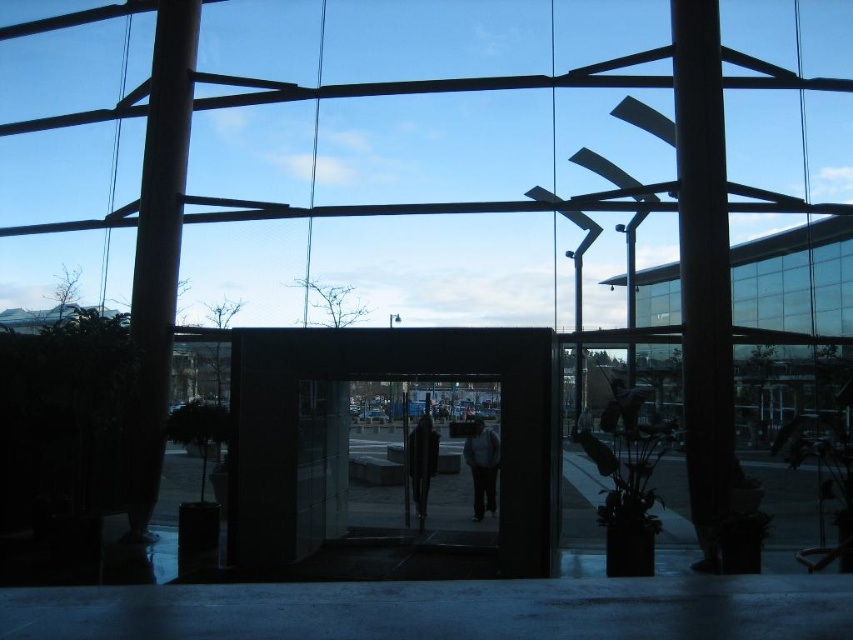
You are organizing a small event in the modern building and need to place a 1.5 meter wide table. Given the space between the matte glass pillar at left and dark gray coat at center, will it fit?

The matte glass pillar at left is larger in size than the dark gray coat at center. However, without specific distance information between them, it is impossible to determine if the 1.5 meter wide table will fit. Additional measurements are needed.

You are standing at the center of the modern building interior. You want to walk towards the black framed doorway to exit. There is a smooth dark brown wooden pillar at right at point (x=703, y=269). Will you need to go around the smooth dark brown wooden pillar at right to reach the doorway?

Yes, you will need to go around the smooth dark brown wooden pillar at right located at point (x=703, y=269) because it is positioned in the path towards the doorway.